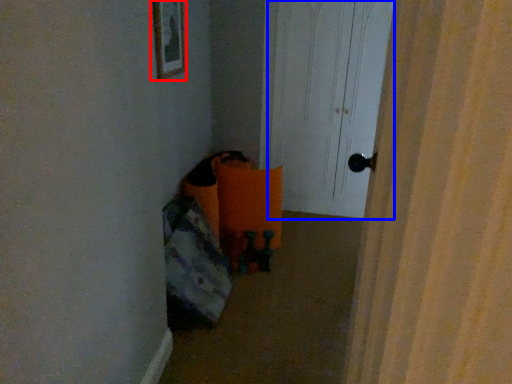
Question: Which of the following is the closest to the observer, picture frame (highlighted by a red box) or screen door (highlighted by a blue box)?

Choices:
 (A) picture frame
 (B) screen door

Answer: (A)